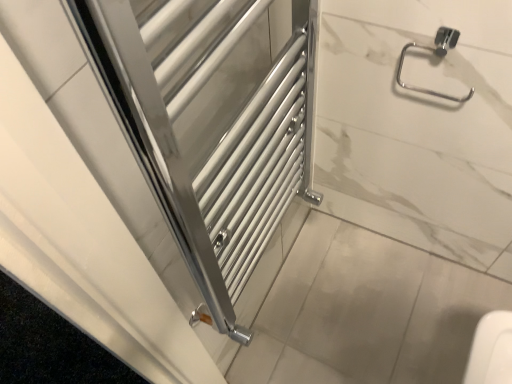
The width and height of the screenshot is (512, 384). What are the coordinates of `chrome/metallic ring at upper right` in the screenshot? It's located at (437, 56).

Based on the photo, what is the approximate width of chrome/metallic ring at upper right?

chrome/metallic ring at upper right is 1.85 inches wide.

The image size is (512, 384). What do you see at coordinates (437, 56) in the screenshot?
I see `chrome/metallic ring at upper right` at bounding box center [437, 56].

Find the location of a particular element. The width and height of the screenshot is (512, 384). chrome/metallic ring at upper right is located at coordinates (437, 56).